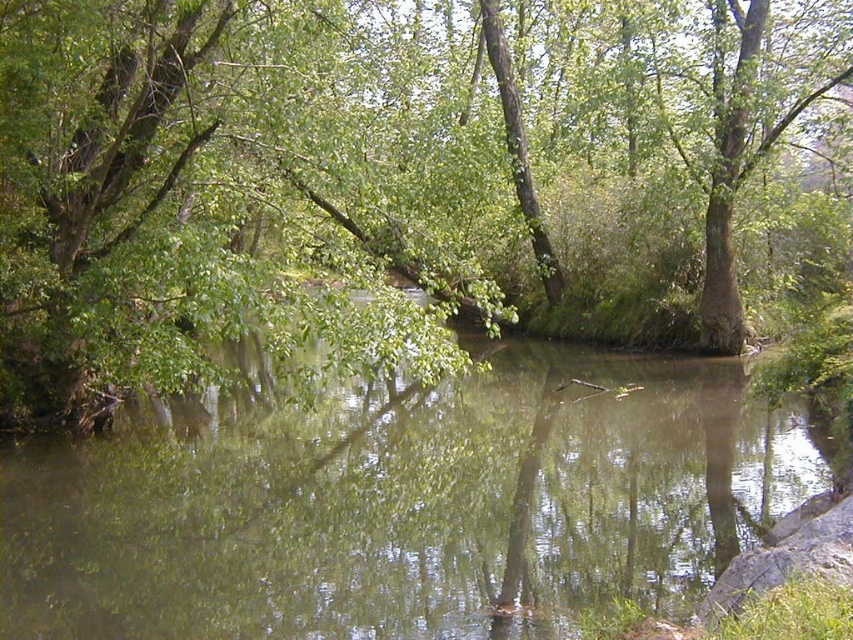
Does green leafy tree at center come in front of green reflective water at center?

No, it is not.

Who is lower down, green leafy tree at center or green reflective water at center?

green reflective water at center is below.

Between point (712, 243) and point (225, 502), which one is positioned in front?

Point (225, 502) is in front.

Find the location of a particular element. The width and height of the screenshot is (853, 640). green leafy tree at center is located at coordinates (386, 179).